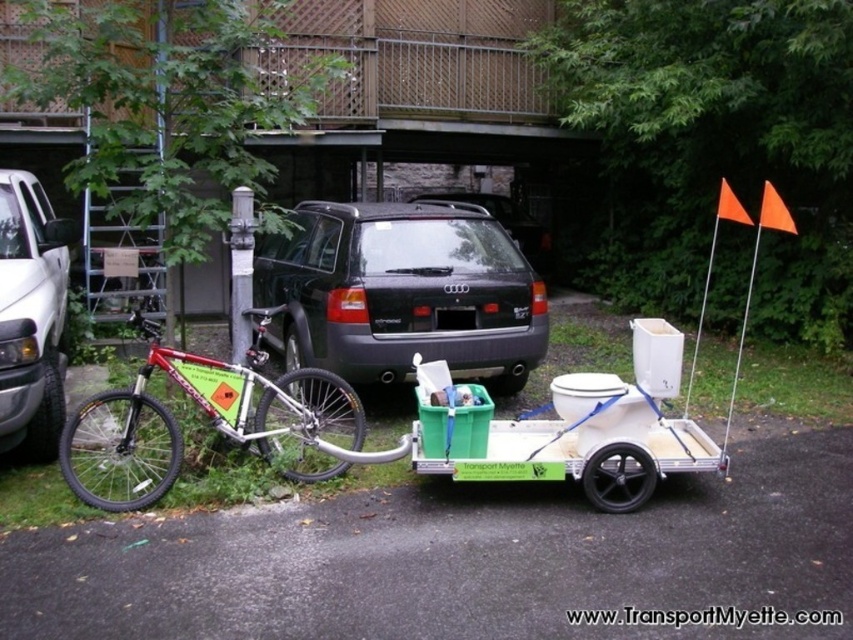
Question: Which is farther from the black matte suv at center?

Choices:
 (A) shiny metallic bicycle at left
 (B) white matte truck at left

Answer: (B)

Question: Which of the following is the closest to the observer?

Choices:
 (A) (346, 323)
 (B) (256, 406)
 (C) (57, 362)

Answer: (B)

Question: Which point is closer to the camera taking this photo?

Choices:
 (A) (32, 188)
 (B) (363, 307)
 (C) (175, 380)

Answer: (C)

Question: Can you confirm if black matte suv at center is positioned to the left of shiny metallic bicycle at left?

Choices:
 (A) yes
 (B) no

Answer: (B)

Question: Where is black matte suv at center located in relation to white matte truck at left in the image?

Choices:
 (A) above
 (B) below

Answer: (A)

Question: Can you confirm if black matte suv at center is bigger than shiny metallic bicycle at left?

Choices:
 (A) no
 (B) yes

Answer: (B)